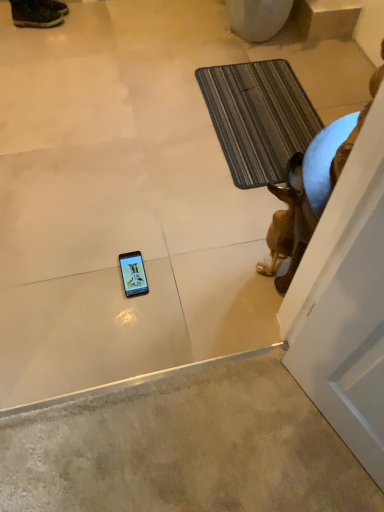
Question: Relative to leather brown boot at upper left, is brown glossy statue at right in front or behind?

Choices:
 (A) behind
 (B) front

Answer: (B)

Question: Is point (362, 112) positioned closer to the camera than point (54, 12)?

Choices:
 (A) closer
 (B) farther

Answer: (A)

Question: Which of these objects is positioned farthest from the leather brown boot at upper left?

Choices:
 (A) striped fabric bath mat at upper right
 (B) brown glossy statue at right

Answer: (B)

Question: Estimate the real-world distances between objects in this image. Which object is closer to the striped fabric bath mat at upper right?

Choices:
 (A) brown glossy statue at right
 (B) leather brown boot at upper left

Answer: (A)